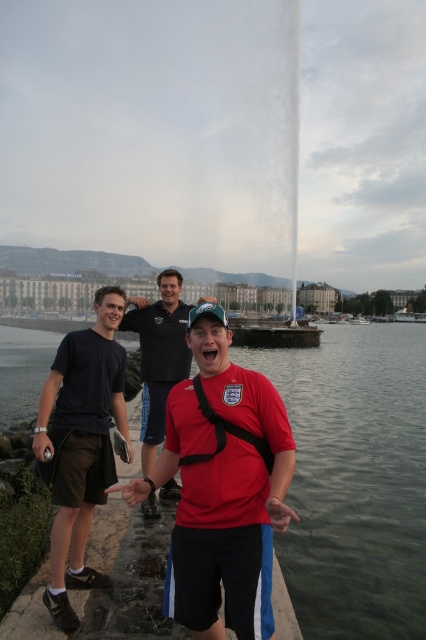
Between clear water at lower center and dark gray cotton t-shirt at center, which one appears on the right side from the viewer's perspective?

From the viewer's perspective, clear water at lower center appears more on the right side.

Is point (296, 548) positioned in front of point (103, 378)?

No, it is behind (103, 378).

At what (x,y) coordinates should I click in order to perform the action: click on clear water at lower center. Please return your answer as a coordinate pair (x, y). Looking at the image, I should click on (356, 477).

Between dark gray cotton t-shirt at center and matte black shirt at center, which one is positioned higher?

matte black shirt at center is above.

Can you confirm if dark gray cotton t-shirt at center is thinner than matte black shirt at center?

No, dark gray cotton t-shirt at center is not thinner than matte black shirt at center.

Who is more distant from viewer, [81,472] or [150,337]?

Point [150,337]

Where is `dark gray cotton t-shirt at center`? dark gray cotton t-shirt at center is located at coordinates (80, 444).

Does clear water at lower center appear on the right side of matte black shirt at center?

Indeed, clear water at lower center is positioned on the right side of matte black shirt at center.

I want to click on clear water at lower center, so click(x=356, y=477).